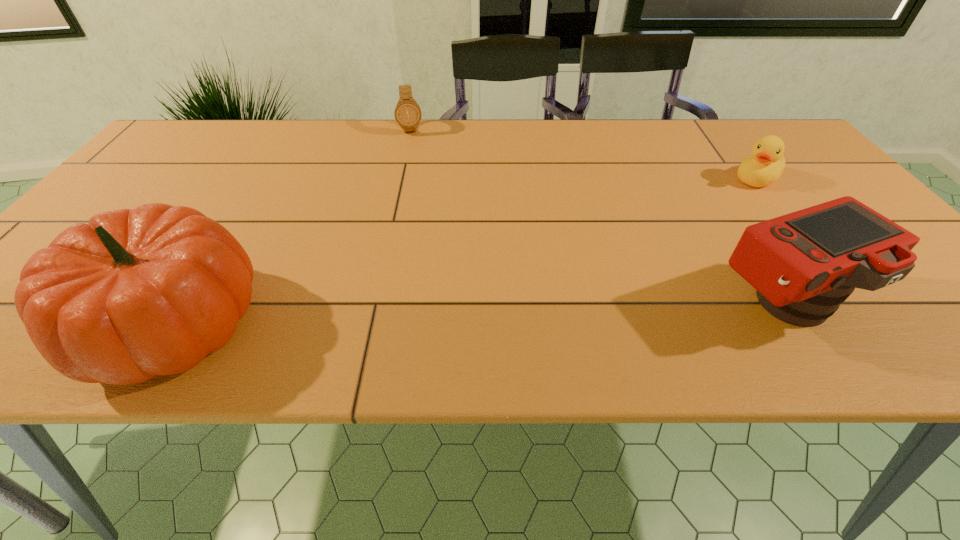
This screenshot has height=540, width=960. I want to click on blank area at the far right corner, so pyautogui.click(x=764, y=133).

In the image, there is a desktop. Where is `free space at the near right corner`? The image size is (960, 540). free space at the near right corner is located at coordinates (937, 295).

Locate an element on the screen. Image resolution: width=960 pixels, height=540 pixels. vacant area between the pumpkin and the third object from right to left is located at coordinates (292, 226).

This screenshot has width=960, height=540. What are the coordinates of `free space between the leftmost object and the watch` in the screenshot? It's located at (292, 226).

Where is `free space that is in between the pumpkin and the camera`? free space that is in between the pumpkin and the camera is located at coordinates (476, 315).

Identify the location of vacant region between the watch and the third nearest object. This screenshot has height=540, width=960. (585, 154).

Identify the location of vacant region between the leftmost object and the third nearest object. [x=464, y=251].

Identify the location of empty location between the second tallest object and the pumpkin. This screenshot has width=960, height=540. (476, 315).

This screenshot has height=540, width=960. What are the coordinates of `free spot between the watch and the leftmost object` in the screenshot? It's located at (292, 226).

Find the location of a particular element. This screenshot has height=540, width=960. vacant point located between the third shortest object and the leftmost object is located at coordinates (476, 315).